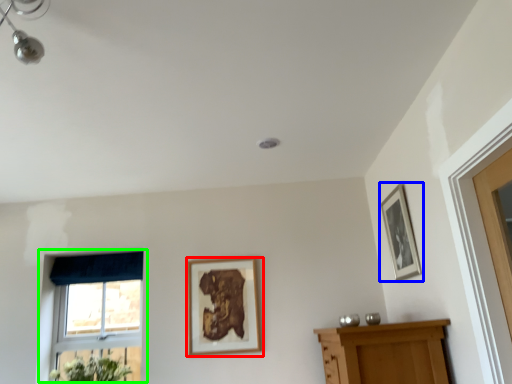
Question: Which object is positioned closest to picture frame (highlighted by a red box)? Select from picture frame (highlighted by a blue box) and window (highlighted by a green box).

Choices:
 (A) picture frame
 (B) window

Answer: (B)